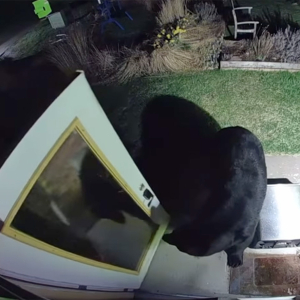
This screenshot has height=300, width=300. I want to click on arms of seat, so click(248, 22), click(245, 7).